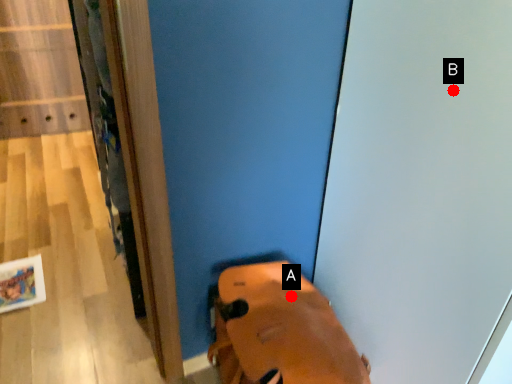
Question: Two points are circled on the image, labeled by A and B beside each circle. Which point is farther to the camera?

Choices:
 (A) A is further
 (B) B is further

Answer: (A)